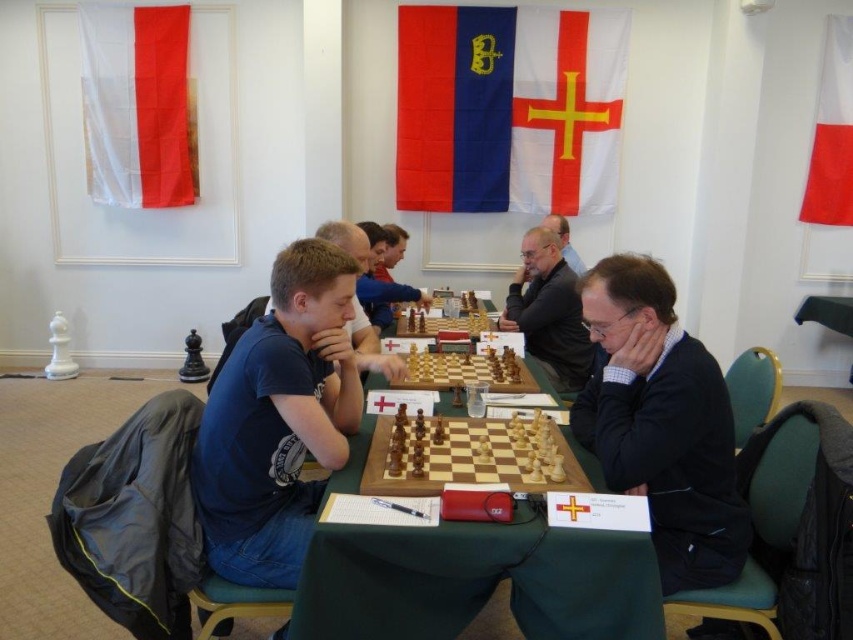
Does wooden chessboard at center have a smaller size compared to matte black sweater at center?

Yes.

Between wooden chessboard at center and matte black sweater at center, which one has more height?

Standing taller between the two is matte black sweater at center.

Who is more forward, (540, 456) or (553, 310)?

Point (540, 456)

The width and height of the screenshot is (853, 640). Identify the location of wooden chessboard at center. (473, 456).

Is point (375, 467) closer to viewer compared to point (357, 305)?

Yes, it is in front of point (357, 305).

Who is more forward, (492, 438) or (368, 244)?

Point (492, 438) is in front.

Where is `wooden chessboard at center`? This screenshot has width=853, height=640. wooden chessboard at center is located at coordinates (473, 456).

Can you confirm if wooden at center is shorter than matte black sweater at center?

Correct, wooden at center is not as tall as matte black sweater at center.

Between wooden at center and matte black sweater at center, which one is positioned lower?

wooden at center is below.

Identify the location of wooden at center. This screenshot has width=853, height=640. (477, 580).